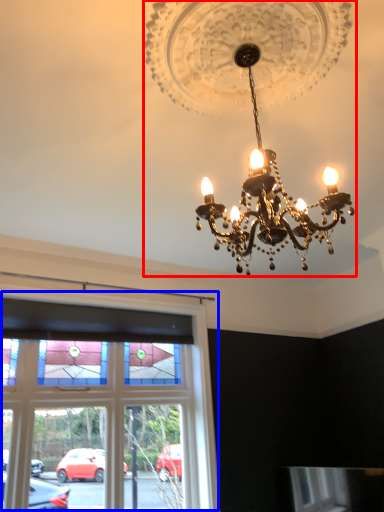
Question: Which of the following is the farthest to the observer, lamp (highlighted by a red box) or window (highlighted by a blue box)?

Choices:
 (A) lamp
 (B) window

Answer: (B)